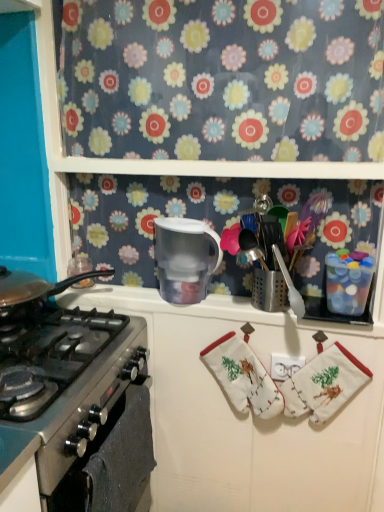
Question: Is point (331, 404) positioned closer to the camera than point (172, 35)?

Choices:
 (A) farther
 (B) closer

Answer: (A)

Question: Based on their positions, is white cotton oven mitts at lower right located to the left or right of floral fabric at upper center?

Choices:
 (A) right
 (B) left

Answer: (A)

Question: Considering the real-world distances, which object is farthest from the stainless steel oven at lower left?

Choices:
 (A) stainless steel gas stove at left
 (B) white fabric hand towel at center
 (C) white plastic outlet at center
 (D) transparent plastic pitcher at center
 (E) white cotton oven mitts at lower right

Answer: (E)

Question: Estimate the real-world distances between objects in this image. Which object is farther from the white fabric hand towel at center?

Choices:
 (A) stainless steel gas stove at left
 (B) white cotton oven mitts at lower right
 (C) stainless steel oven at lower left
 (D) floral fabric at upper center
 (E) transparent plastic pitcher at center

Answer: (D)